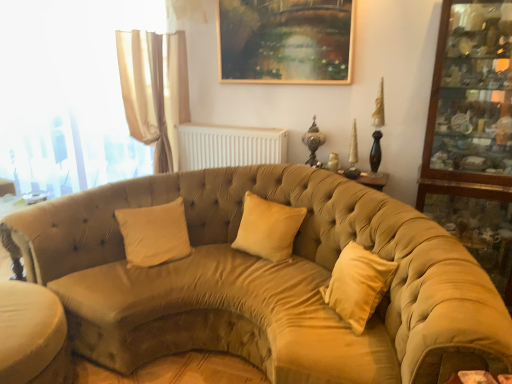
Question: Can you confirm if wooden glass cabinet at right is thinner than beige velvet pillow at center, the first pillow in the left-to-right sequence?

Choices:
 (A) yes
 (B) no

Answer: (B)

Question: Is wooden glass cabinet at right surrounding beige velvet pillow at center, which is the 2th pillow from right to left?

Choices:
 (A) no
 (B) yes

Answer: (A)

Question: Is wooden glass cabinet at right oriented away from beige velvet pillow at center, the first pillow in the left-to-right sequence?

Choices:
 (A) no
 (B) yes

Answer: (A)

Question: Considering the relative positions of wooden glass cabinet at right and beige velvet pillow at center, the first pillow in the left-to-right sequence, in the image provided, is wooden glass cabinet at right in front of beige velvet pillow at center, the first pillow in the left-to-right sequence,?

Choices:
 (A) no
 (B) yes

Answer: (B)

Question: Is wooden glass cabinet at right shorter than beige velvet pillow at center, which is the 2th pillow from right to left?

Choices:
 (A) no
 (B) yes

Answer: (A)

Question: Based on their sizes in the image, would you say suede-like beige pillow at center, the 1th pillow in the right-to-left sequence, is bigger or smaller than white plastic radiator at upper center?

Choices:
 (A) small
 (B) big

Answer: (A)

Question: Relative to white plastic radiator at upper center, is suede-like beige pillow at center, acting as the 2th pillow starting from the left, in front or behind?

Choices:
 (A) behind
 (B) front

Answer: (B)

Question: Considering the positions of point pyautogui.click(x=286, y=218) and point pyautogui.click(x=274, y=153), is point pyautogui.click(x=286, y=218) closer or farther from the camera than point pyautogui.click(x=274, y=153)?

Choices:
 (A) closer
 (B) farther

Answer: (A)

Question: From a real-world perspective, relative to white plastic radiator at upper center, is suede-like beige pillow at center, the 1th pillow in the right-to-left sequence, vertically above or below?

Choices:
 (A) below
 (B) above

Answer: (A)

Question: Considering the positions of translucent fabric curtain at left and suede-like beige pillow at center, acting as the 2th pillow starting from the left, in the image, is translucent fabric curtain at left bigger or smaller than suede-like beige pillow at center, acting as the 2th pillow starting from the left,?

Choices:
 (A) big
 (B) small

Answer: (A)

Question: Would you say translucent fabric curtain at left is to the left or to the right of suede-like beige pillow at center, acting as the 2th pillow starting from the left, in the picture?

Choices:
 (A) right
 (B) left

Answer: (B)

Question: In terms of width, does translucent fabric curtain at left look wider or thinner when compared to suede-like beige pillow at center, acting as the 2th pillow starting from the left?

Choices:
 (A) wide
 (B) thin

Answer: (B)

Question: Is translucent fabric curtain at left in front of or behind suede-like beige pillow at center, acting as the 2th pillow starting from the left, in the image?

Choices:
 (A) front
 (B) behind

Answer: (B)

Question: From their relative heights in the image, would you say gold-framed painting at upper center is taller or shorter than wooden glass cabinet at right?

Choices:
 (A) short
 (B) tall

Answer: (A)

Question: From the image's perspective, is gold-framed painting at upper center above or below wooden glass cabinet at right?

Choices:
 (A) below
 (B) above

Answer: (B)